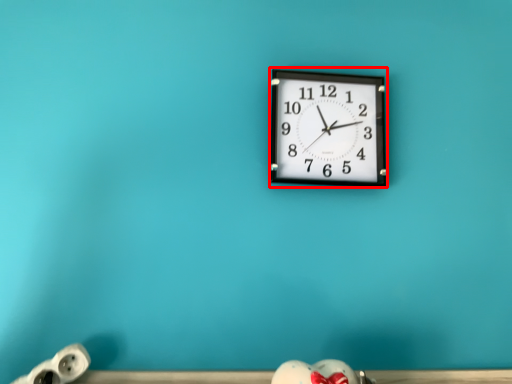
Question: From the image's perspective, considering the relative positions of wall clock (annotated by the red box) and toy in the image provided, where is wall clock (annotated by the red box) located with respect to the staircase?

Choices:
 (A) below
 (B) above

Answer: (B)